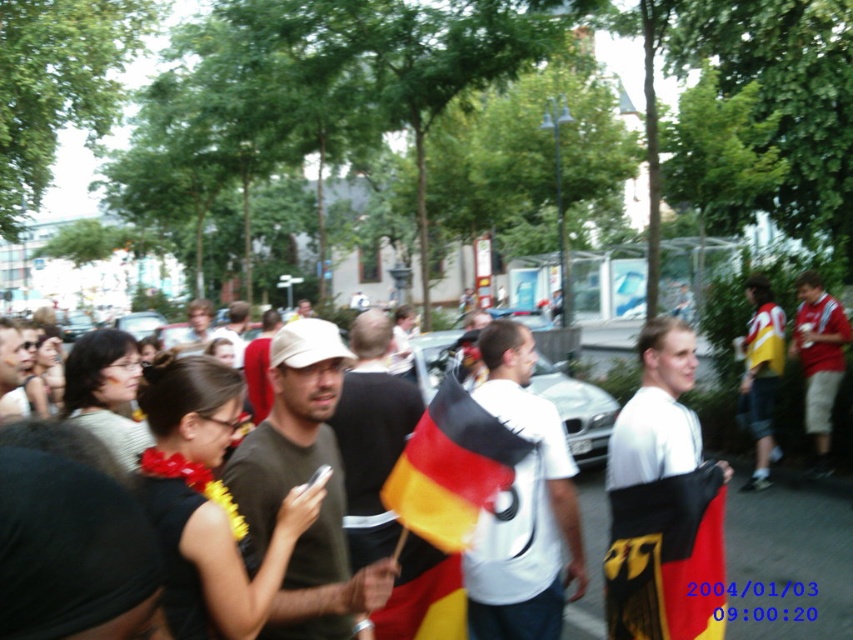
You are a photographer trying to capture a clear shot of both the black and red fabric flag at center and the red cotton shirt at center. Based on their sizes in the image, which object should you focus on first to ensure it is in sharp focus?

The black and red fabric flag at center occupies less space than the red cotton shirt at center, so you should focus on the black and red fabric flag at center first to ensure it is in sharp focus since smaller objects require precise focusing.

You are a photographer standing in the crowd at the event. You want to take a photo of the red cotton shirt at center without the black and red fabric flag at center blocking it. Which direction should you move to achieve this?

Since the black and red fabric flag at center is to the left of the red cotton shirt at center, you should move to the right to position yourself where the flag no longer blocks the shirt.

Based on the photo, you are a photographer standing at the edge of the crowd. You want to take a photo of the black and red fabric flag at center. Based on its coordinates, where should you aim your camera?

The black and red fabric flag at center is located at coordinates point (666, 557), so you should aim your camera towards that point to capture it.